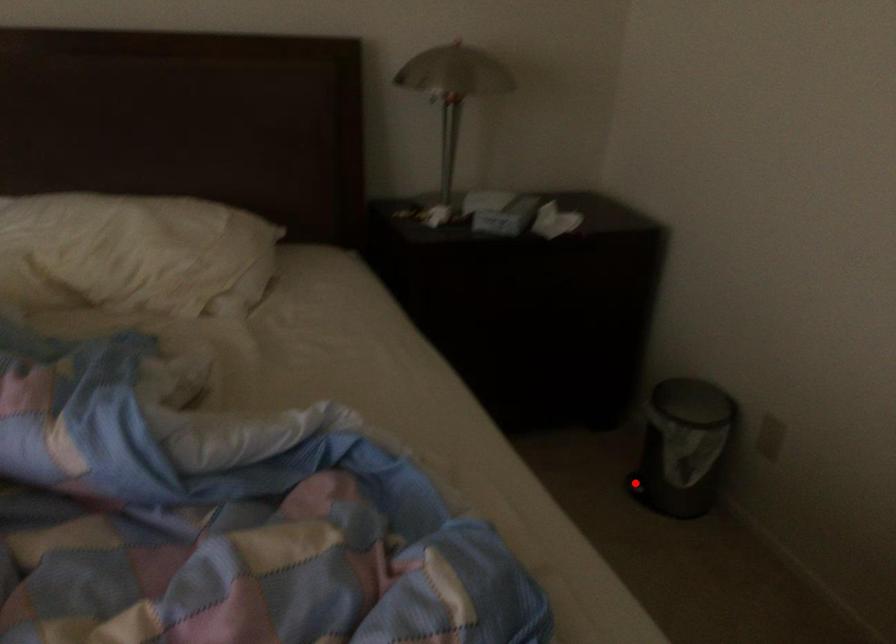
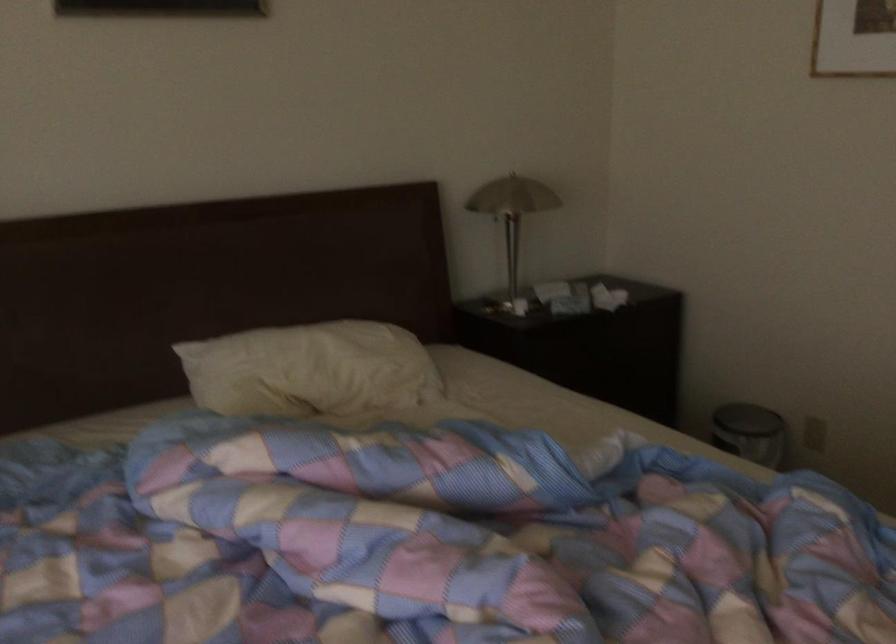
Question: I am providing you with two images of the same scene from different viewpoints. A red point is marked on the first image. At the location where the point appears in image 1, is it still visible in image 2?

Choices:
 (A) Yes
 (B) No

Answer: (B)